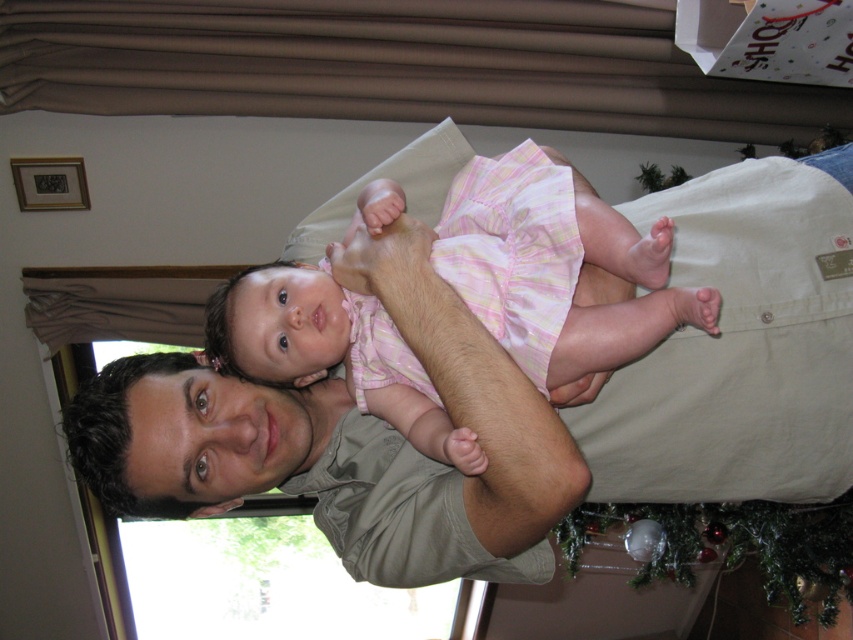
You are a fashion designer observing the scene. You need to determine which clothing item, the matte khaki shirt at center or the pink plaid dress at center, would require more fabric to produce based on their sizes. Which one would need more fabric?

The matte khaki shirt at center has a larger size compared to the pink plaid dress at center, so it would require more fabric to produce.

Based on the photo, you are a photographer adjusting your camera settings. You notice two points in the image at coordinates point (126, 490) and point (567, 321). Based on their positions relative to the camera, which point is closer to the camera?

Point (126, 490) is further to the camera than point (567, 321), so point (126, 490) is closer to the camera.

You are a photographer setting up a shoot in this scene. You need to place a small prop between the matte khaki shirt at center and the pink plaid dress at center. Based on their positions, where should you place the prop so it sits between them?

The matte khaki shirt at center is below the pink plaid dress at center, so you should place the prop between them by positioning it above the matte khaki shirt at center and below the pink plaid dress at center.